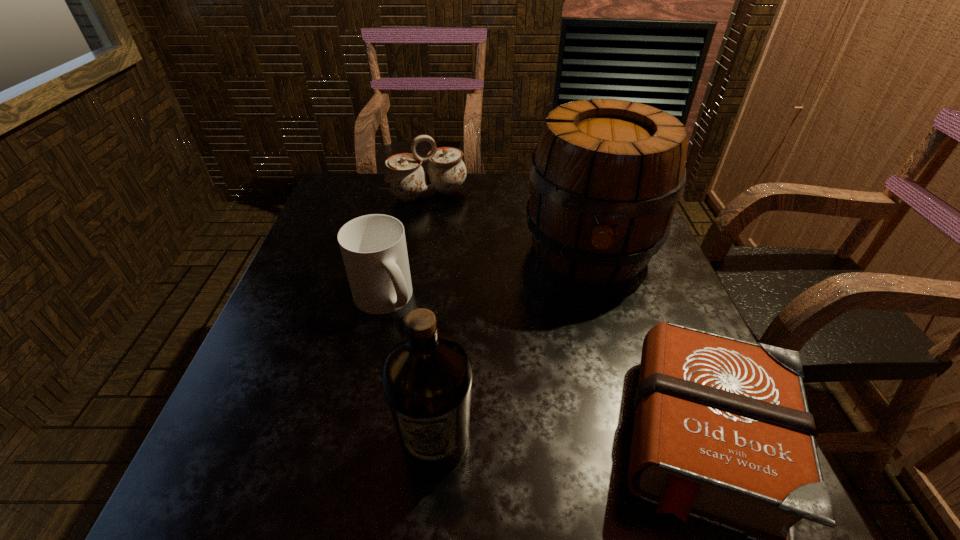
At what (x,y) coordinates should I click in order to perform the action: click on olive oil. Please return your answer as a coordinate pair (x, y). Image resolution: width=960 pixels, height=540 pixels. Looking at the image, I should click on (427, 376).

Locate an element on the screen. The height and width of the screenshot is (540, 960). mug is located at coordinates (373, 247).

Locate an element on the screen. the farthest object is located at coordinates (405, 178).

Where is `cider`? cider is located at coordinates pyautogui.click(x=606, y=176).

Identify the location of vacant space located 0.180m on the handle side of the mug. The height and width of the screenshot is (540, 960). (461, 363).

I want to click on vacant point located 0.310m on the handle side of the mug, so click(511, 404).

At what (x,y) coordinates should I click in order to perform the action: click on free space located on the handle side of the mug. Please return your answer as a coordinate pair (x, y). This screenshot has width=960, height=540. Looking at the image, I should click on (511, 404).

Find the location of a particular element. This screenshot has width=960, height=540. vacant area situated by the handle of the farthest object is located at coordinates (455, 241).

Where is `free space located 0.050m by the handle of the farthest object`? The image size is (960, 540). free space located 0.050m by the handle of the farthest object is located at coordinates (x=444, y=217).

Locate an element on the screen. The image size is (960, 540). vacant space located by the handle of the farthest object is located at coordinates (453, 237).